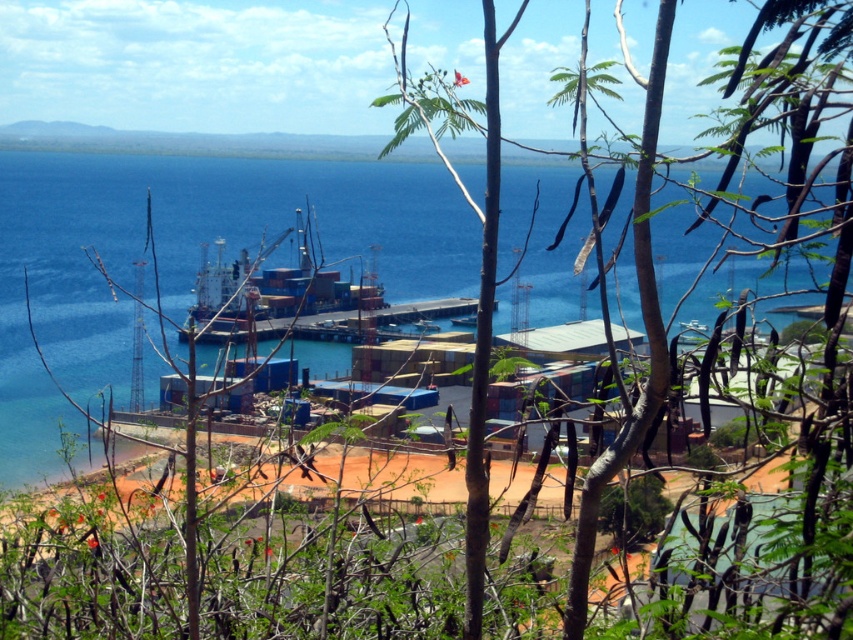
Is green leafy branches at center to the right of blue water at center from the viewer's perspective?

Indeed, green leafy branches at center is positioned on the right side of blue water at center.

In the scene shown: Does green leafy branches at center have a greater width compared to blue water at center?

In fact, green leafy branches at center might be narrower than blue water at center.

Which is in front, point (712, 337) or point (91, 305)?

Positioned in front is point (712, 337).

In order to click on green leafy branches at center in this screenshot , I will do `click(740, 332)`.